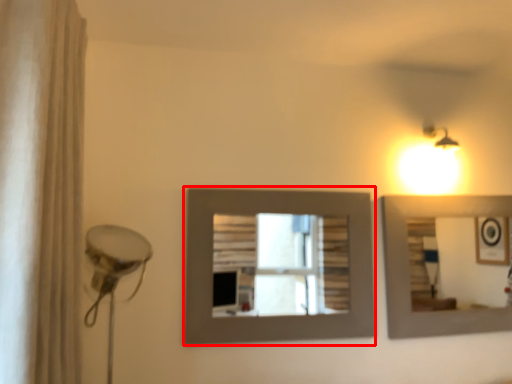
Question: From the image, what is the correct spatial relationship of picture frame (annotated by the red box) in relation to shower curtain?

Choices:
 (A) right
 (B) left

Answer: (A)